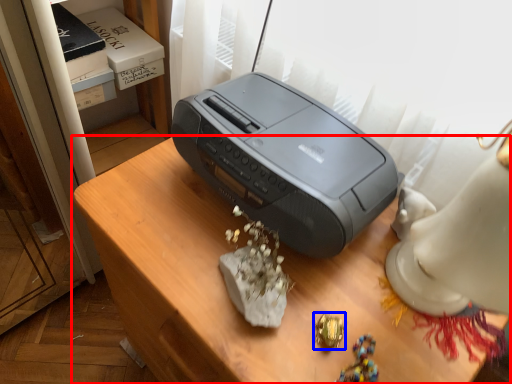
Question: Which of the following is the farthest to the observer, furniture (highlighted by a red box) or jewellery (highlighted by a blue box)?

Choices:
 (A) furniture
 (B) jewellery

Answer: (B)